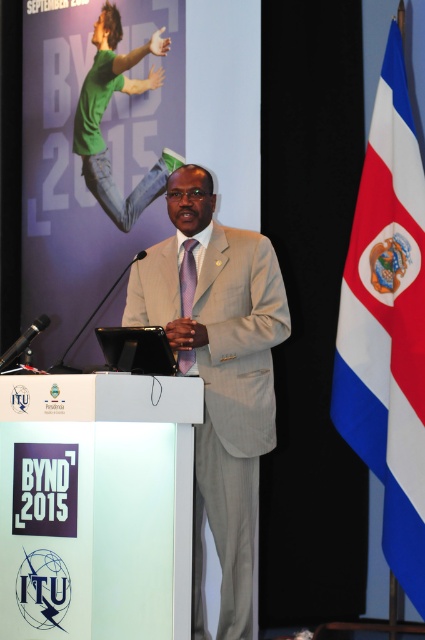
Question: Which object appears farthest from the camera in this image?

Choices:
 (A) white fabric flag at right
 (B) beige textured suit at center
 (C) purple satin tie at center
 (D) green matte t-shirt at upper left

Answer: (D)

Question: Where is beige textured suit at center located in relation to white fabric flag at right in the image?

Choices:
 (A) above
 (B) below

Answer: (B)

Question: Considering the real-world distances, which object is closest to the beige textured suit at center?

Choices:
 (A) white fabric flag at right
 (B) purple satin tie at center

Answer: (B)

Question: Does beige textured suit at center have a greater width compared to purple satin tie at center?

Choices:
 (A) yes
 (B) no

Answer: (A)

Question: Does white fabric flag at right have a larger size compared to purple satin tie at center?

Choices:
 (A) yes
 (B) no

Answer: (A)

Question: Estimate the real-world distances between objects in this image. Which object is farther from the purple satin tie at center?

Choices:
 (A) green matte t-shirt at upper left
 (B) white fabric flag at right

Answer: (A)